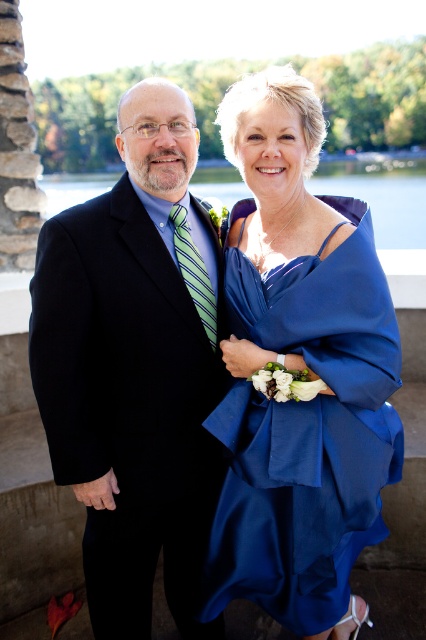
Is point (138, 189) positioned in front of point (230, 198)?

Yes, it is.

Does matte black suit at left appear on the left side of blue satin dress at upper center?

Indeed, matte black suit at left is positioned on the left side of blue satin dress at upper center.

Between point (149, 637) and point (385, 220), which one is positioned behind?

Positioned behind is point (385, 220).

At what (x,y) coordinates should I click in order to perform the action: click on matte black suit at left. Please return your answer as a coordinate pair (x, y). This screenshot has width=426, height=640. Looking at the image, I should click on (135, 369).

Which is more to the right, matte black suit at left or satin blue dress at center?

satin blue dress at center is more to the right.

Is matte black suit at left thinner than satin blue dress at center?

Yes, matte black suit at left is thinner than satin blue dress at center.

In order to click on matte black suit at left in this screenshot , I will do `click(135, 369)`.

Does satin blue dress at center appear on the right side of blue satin dress at upper center?

In fact, satin blue dress at center is to the left of blue satin dress at upper center.

Is point (267, 339) positioned before point (380, 224)?

Yes, it is in front of point (380, 224).

Where is `satin blue dress at center`? This screenshot has height=640, width=426. satin blue dress at center is located at coordinates (307, 433).